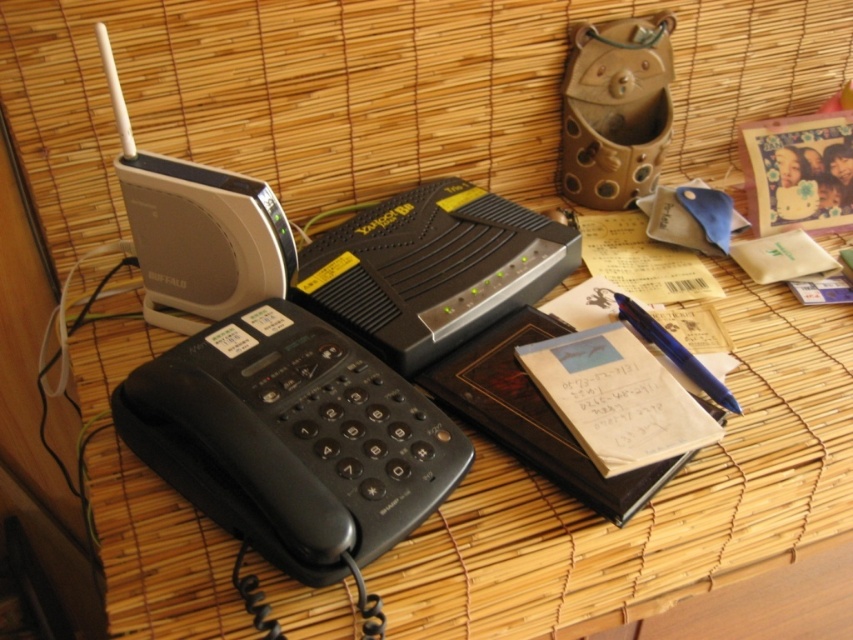
Question: Can you confirm if black plastic phone at upper left is bigger than black plastic phone at lower left?

Choices:
 (A) no
 (B) yes

Answer: (B)

Question: Among these points, which one is nearest to the camera?

Choices:
 (A) (144, 580)
 (B) (643, 314)

Answer: (A)

Question: Among these objects, which one is nearest to the camera?

Choices:
 (A) blue metallic pen at right
 (B) black plastic phone at lower left
 (C) black plastic phone at upper left

Answer: (B)

Question: Is black plastic phone at upper left bigger than black plastic phone at lower left?

Choices:
 (A) yes
 (B) no

Answer: (A)

Question: Which of the following is the farthest from the observer?

Choices:
 (A) (271, 625)
 (B) (674, 364)

Answer: (B)

Question: Does black plastic phone at upper left have a lesser width compared to black plastic phone at lower left?

Choices:
 (A) no
 (B) yes

Answer: (A)